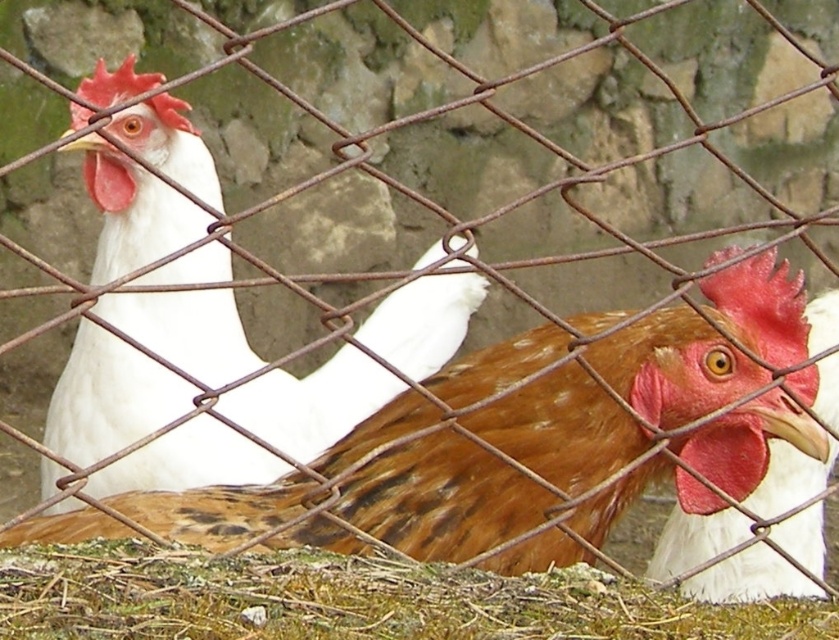
Question: Can you confirm if brown textured hay at lower center is bigger than brown speckled feathers at center?

Choices:
 (A) yes
 (B) no

Answer: (B)

Question: Which point is closer to the camera?

Choices:
 (A) (791, 504)
 (B) (636, 596)
 (C) (199, 147)

Answer: (B)

Question: Is white matte chicken at left wider than brown textured hay at lower center?

Choices:
 (A) yes
 (B) no

Answer: (B)

Question: Which object appears farthest from the camera in this image?

Choices:
 (A) brown speckled feathers at center
 (B) brown textured hay at lower center

Answer: (A)

Question: Can you confirm if brown textured hay at lower center is thinner than brown speckled feathers at center?

Choices:
 (A) yes
 (B) no

Answer: (B)

Question: Which object is farther from the camera taking this photo?

Choices:
 (A) brown textured hay at lower center
 (B) brown speckled feathers at center
 (C) white matte chicken at left

Answer: (C)